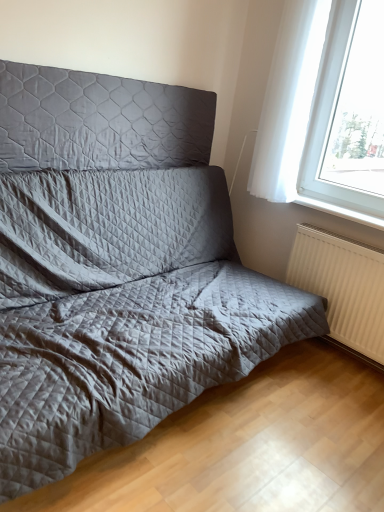
Question: Is quilted fabric headboard at upper left far from white sheer curtain at upper right?

Choices:
 (A) no
 (B) yes

Answer: (B)

Question: From a real-world perspective, is quilted fabric headboard at upper left physically below white sheer curtain at upper right?

Choices:
 (A) yes
 (B) no

Answer: (A)

Question: Are quilted fabric headboard at upper left and white sheer curtain at upper right beside each other?

Choices:
 (A) yes
 (B) no

Answer: (B)

Question: Does quilted fabric headboard at upper left have a greater width compared to white sheer curtain at upper right?

Choices:
 (A) yes
 (B) no

Answer: (B)

Question: Can you confirm if quilted fabric headboard at upper left is thinner than white sheer curtain at upper right?

Choices:
 (A) yes
 (B) no

Answer: (A)

Question: Is quilted fabric headboard at upper left spatially inside white glossy window sill at lower right, or outside of it?

Choices:
 (A) inside
 (B) outside

Answer: (B)

Question: Is point (140, 130) closer or farther from the camera than point (306, 197)?

Choices:
 (A) farther
 (B) closer

Answer: (B)

Question: Relative to white glossy window sill at lower right, is quilted fabric headboard at upper left in front or behind?

Choices:
 (A) behind
 (B) front

Answer: (B)

Question: From the image's perspective, is quilted fabric headboard at upper left above or below white glossy window sill at lower right?

Choices:
 (A) below
 (B) above

Answer: (B)

Question: Considering the positions of point (331, 323) and point (120, 78), is point (331, 323) closer or farther from the camera than point (120, 78)?

Choices:
 (A) closer
 (B) farther

Answer: (B)

Question: Considering the positions of white textured radiator at lower right and quilted fabric headboard at upper left in the image, is white textured radiator at lower right taller or shorter than quilted fabric headboard at upper left?

Choices:
 (A) tall
 (B) short

Answer: (A)

Question: Considering their positions, is white textured radiator at lower right located in front of or behind quilted fabric headboard at upper left?

Choices:
 (A) behind
 (B) front

Answer: (A)

Question: From the image's perspective, is white textured radiator at lower right positioned above or below quilted fabric headboard at upper left?

Choices:
 (A) below
 (B) above

Answer: (A)

Question: Looking at their shapes, would you say white glossy window sill at lower right is wider or thinner than quilted fabric headboard at upper left?

Choices:
 (A) wide
 (B) thin

Answer: (A)

Question: From the image's perspective, relative to quilted fabric headboard at upper left, is white glossy window sill at lower right above or below?

Choices:
 (A) below
 (B) above

Answer: (A)